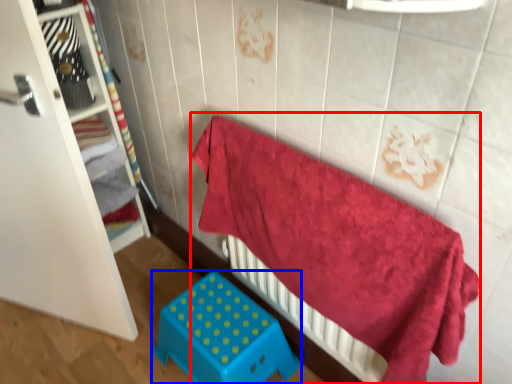
Question: Which object is further to the camera taking this photo, bed (highlighted by a red box) or furniture (highlighted by a blue box)?

Choices:
 (A) bed
 (B) furniture

Answer: (B)